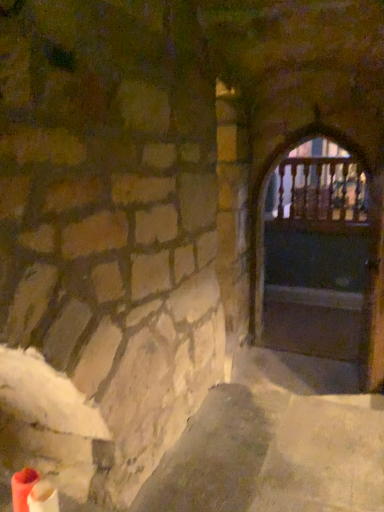
What do you see at coordinates (264, 206) in the screenshot? I see `wooden at right` at bounding box center [264, 206].

This screenshot has width=384, height=512. In order to click on wooden at right in this screenshot , I will do `click(264, 206)`.

This screenshot has height=512, width=384. Describe the element at coordinates (318, 185) in the screenshot. I see `wooden railing at center` at that location.

At what (x,y) coordinates should I click in order to perform the action: click on wooden railing at center. Please return your answer as a coordinate pair (x, y). Looking at the image, I should click on (318, 185).

At what (x,y) coordinates should I click in order to perform the action: click on wooden at right. Please return your answer as a coordinate pair (x, y). Looking at the image, I should click on (264, 206).

Visually, is wooden railing at center positioned to the left or to the right of wooden at right?

wooden railing at center is to the right of wooden at right.

Is the depth of wooden railing at center less than that of wooden at right?

That is False.

Is point (317, 155) farther from camera compared to point (254, 192)?

That is True.

From the image's perspective, would you say wooden railing at center is shown under wooden at right?

Incorrect, from the image's perspective, wooden railing at center is higher than wooden at right.

From a real-world perspective, is wooden railing at center above or below wooden at right?

wooden railing at center is above wooden at right.

Is wooden railing at center thinner than wooden at right?

Correct, the width of wooden railing at center is less than that of wooden at right.

Who is taller, wooden railing at center or wooden at right?

wooden at right is taller.

Considering the sizes of wooden railing at center and wooden at right in the image, is wooden railing at center bigger or smaller than wooden at right?

Clearly, wooden railing at center is smaller in size than wooden at right.

Is wooden railing at center spatially inside wooden at right, or outside of it?

The correct answer is: outside.

Is wooden railing at center not near wooden at right?

Yes, wooden railing at center and wooden at right are located far from each other.

Could you tell me if wooden railing at center is facing wooden at right?

Yes, wooden railing at center is facing wooden at right.

Measure the distance between wooden railing at center and wooden at right.

A distance of 2.42 meters exists between wooden railing at center and wooden at right.

This screenshot has height=512, width=384. I want to click on door below the wooden railing at center (from the image's perspective), so click(264, 206).

Can you confirm if wooden at right is positioned to the right of wooden railing at center?

In fact, wooden at right is to the left of wooden railing at center.

Which is in front, wooden at right or wooden railing at center?

wooden at right is closer to the camera.

Is point (262, 170) farther from camera compared to point (302, 166)?

No, it is not.

From the image's perspective, between wooden at right and wooden railing at center, which one is located above?

From the image's view, wooden railing at center is above.

From a real-world perspective, is wooden at right positioned above or below wooden railing at center?

In terms of real-world spatial position, wooden at right is below wooden railing at center.

Looking at their sizes, would you say wooden at right is wider or thinner than wooden railing at center?

wooden at right is wider than wooden railing at center.

Can you confirm if wooden at right is taller than wooden railing at center?

Yes.

Considering the relative sizes of wooden at right and wooden railing at center in the image provided, is wooden at right bigger than wooden railing at center?

Correct, wooden at right is larger in size than wooden railing at center.

Does wooden at right contain wooden railing at center?

No.

Is wooden at right directly adjacent to wooden railing at center?

They are not placed beside each other.

Is wooden at right turned away from wooden railing at center?

Absolutely, wooden at right is directed away from wooden railing at center.

How much distance is there between wooden at right and wooden railing at center?

The distance of wooden at right from wooden railing at center is 2.42 meters.

Where is `window above the wooden at right (from a real-world perspective)`? Image resolution: width=384 pixels, height=512 pixels. window above the wooden at right (from a real-world perspective) is located at coordinates (318, 185).

Find the location of a particular element. This screenshot has width=384, height=512. door directly beneath the wooden railing at center (from a real-world perspective) is located at coordinates (264, 206).

Image resolution: width=384 pixels, height=512 pixels. I want to click on window above the wooden at right (from a real-world perspective), so click(x=318, y=185).